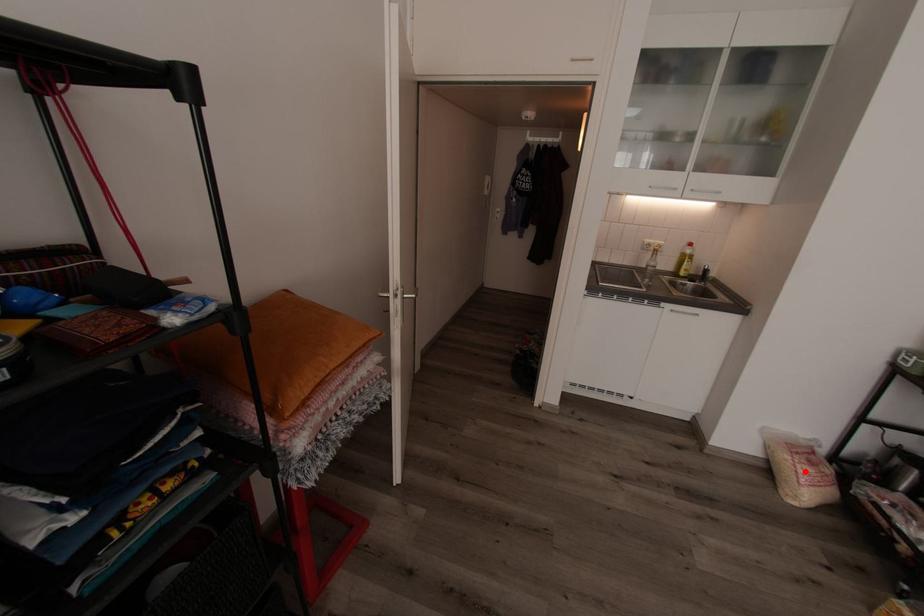
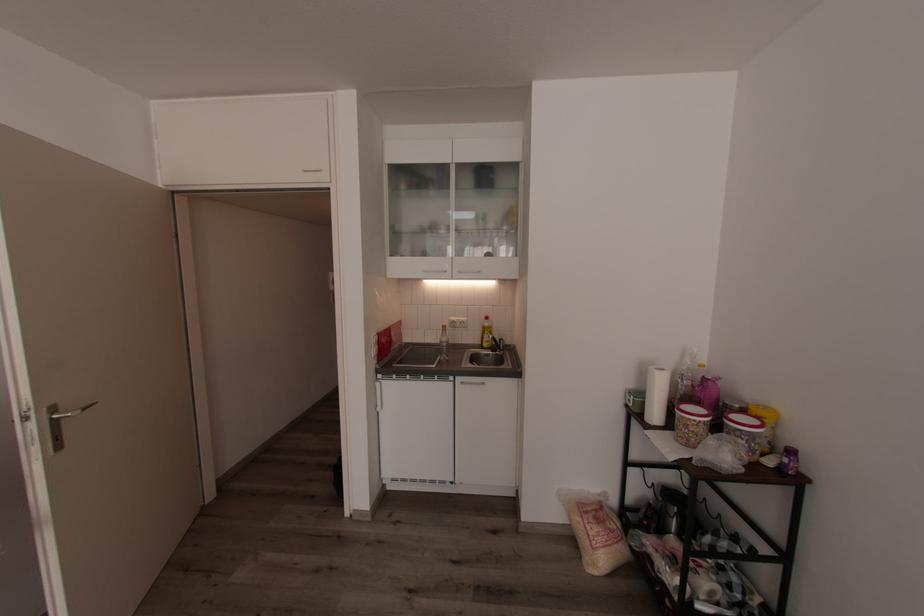
The point at the highlighted location is marked in the first image. Where is the corresponding point in the second image?

(594, 533)